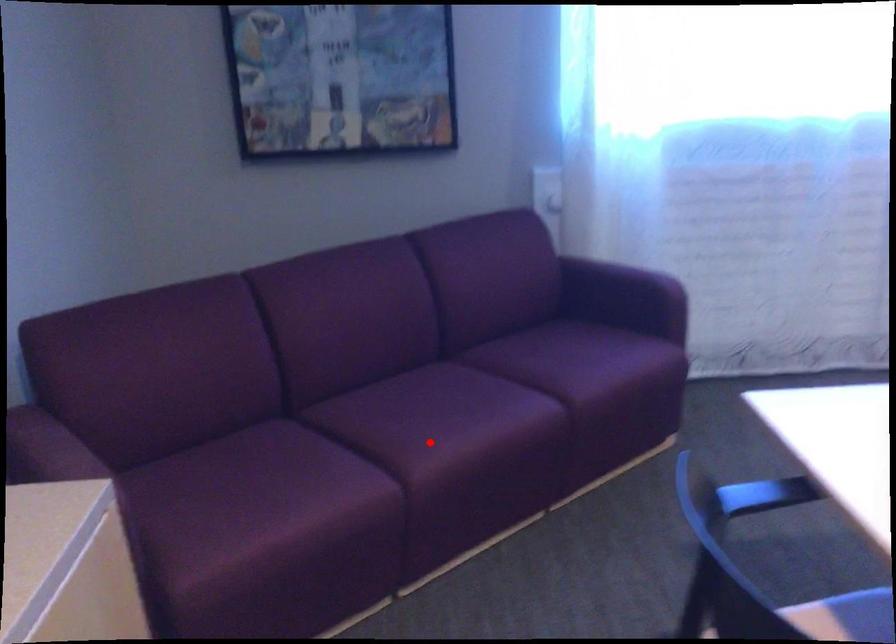
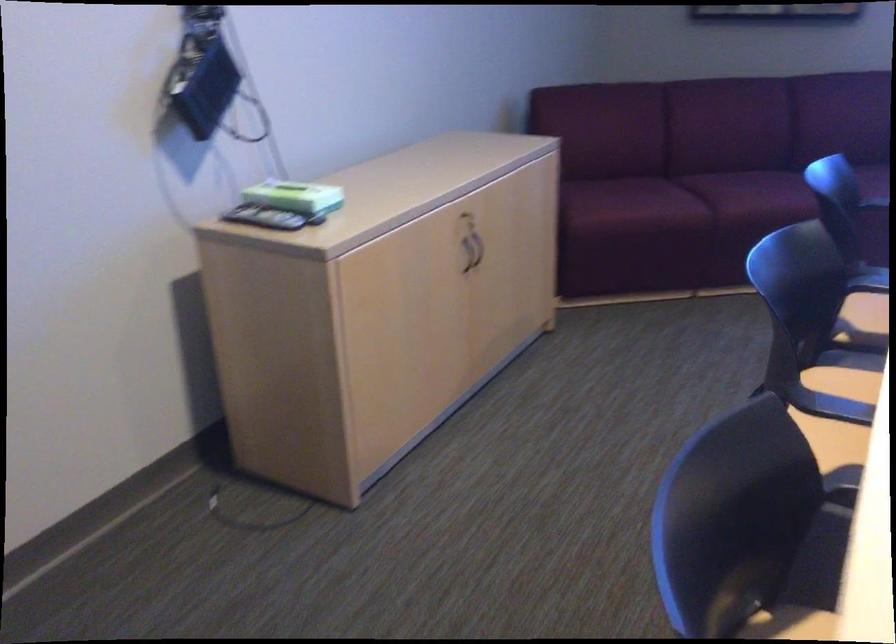
Question: I am providing you with two images of the same scene from different viewpoints. A red point is marked on the first image. At the location where the point appears in image 1, is it still visible in image 2?

Choices:
 (A) Yes
 (B) No

Answer: (A)